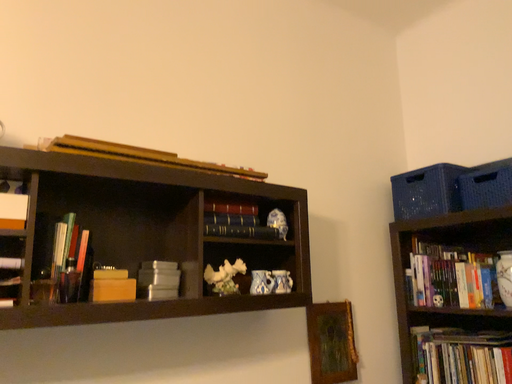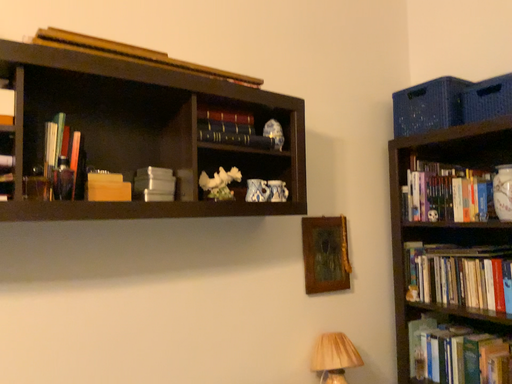
Question: How did the camera likely rotate when shooting the video?

Choices:
 (A) rotated downward
 (B) rotated upward

Answer: (A)